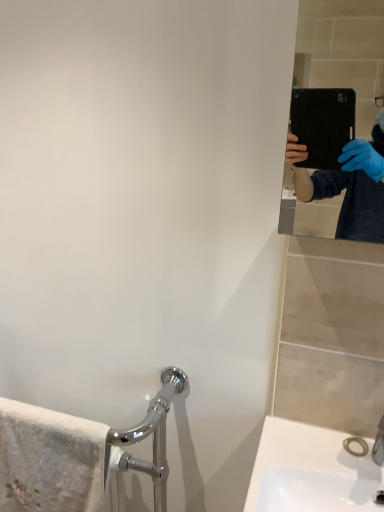
The width and height of the screenshot is (384, 512). Describe the element at coordinates (50, 460) in the screenshot. I see `white textured towel at lower left` at that location.

Where is `white textured towel at lower left`? The height and width of the screenshot is (512, 384). white textured towel at lower left is located at coordinates (50, 460).

The image size is (384, 512). Identify the location of white textured towel at lower left. tap(50, 460).